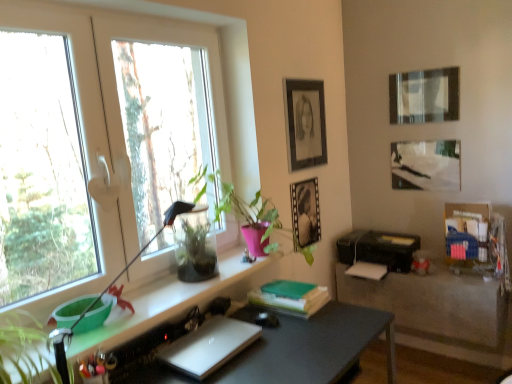
Identify the location of vacant space to the right of sleek silver laptop at center. This screenshot has height=384, width=512. (x=277, y=351).